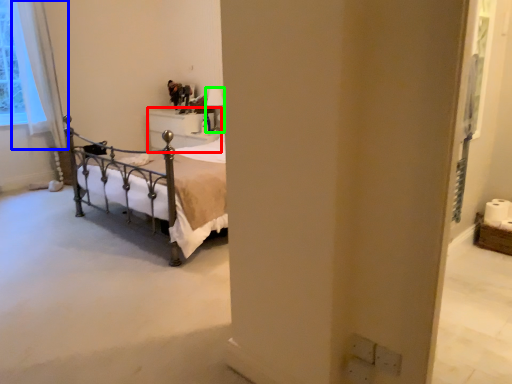
Question: Which is nearer to the furniture (highlighted by a red box)? curtain (highlighted by a blue box) or lamp (highlighted by a green box).

Choices:
 (A) curtain
 (B) lamp

Answer: (B)